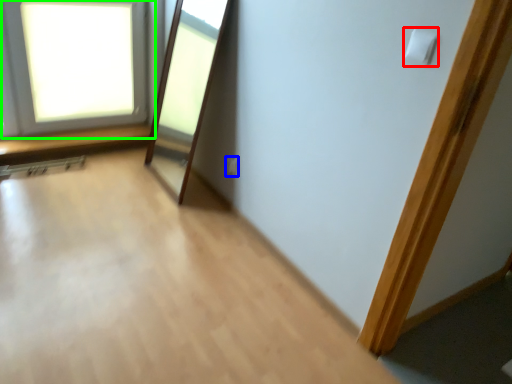
Question: Which object is the farthest from light switch (highlighted by a red box)? Choose among these: electric outlet (highlighted by a blue box) or window (highlighted by a green box).

Choices:
 (A) electric outlet
 (B) window

Answer: (B)